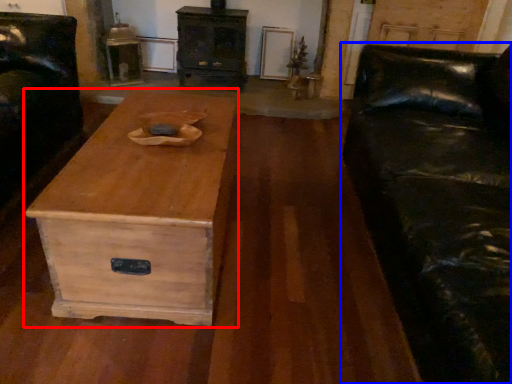
Question: Which object appears farthest to the camera in this image, coffee table (highlighted by a red box) or studio couch (highlighted by a blue box)?

Choices:
 (A) coffee table
 (B) studio couch

Answer: (A)